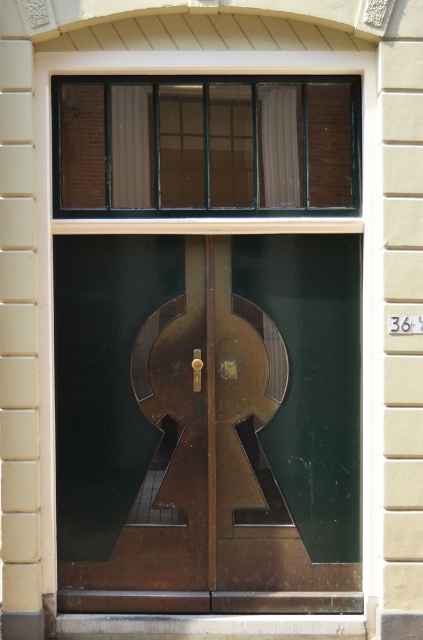
Question: Does bronze metallic door at center appear on the left side of matte glass window at upper center?

Choices:
 (A) yes
 (B) no

Answer: (B)

Question: Is bronze metallic door at center thinner than matte glass window at upper center?

Choices:
 (A) yes
 (B) no

Answer: (A)

Question: Is bronze metallic door at center smaller than matte glass window at upper center?

Choices:
 (A) yes
 (B) no

Answer: (B)

Question: Which point is closer to the camera taking this photo?

Choices:
 (A) (148, 154)
 (B) (85, 259)

Answer: (A)